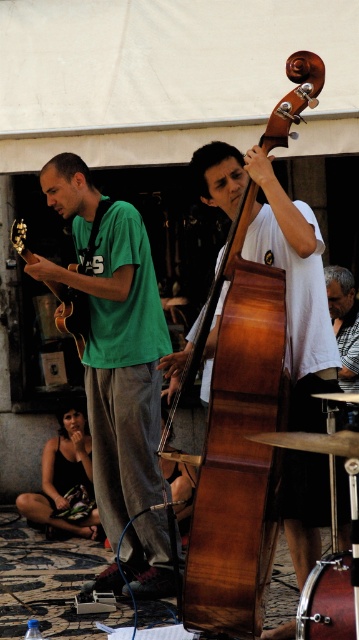
Question: Estimate the real-world distances between objects in this image. Which object is farther from the metallic silver drum at lower right?

Choices:
 (A) green matte shirt at left
 (B) wooden polished cello at center
 (C) black fabric dress at lower left

Answer: (C)

Question: Which point is farther to the camera?

Choices:
 (A) metallic silver drum at lower right
 (B) wooden polished cello at center

Answer: (B)

Question: Which object is positioned farthest from the wooden polished cello at center?

Choices:
 (A) black fabric dress at lower left
 (B) green matte shirt at left

Answer: (A)

Question: Considering the relative positions of black fabric dress at lower left and metallic silver drum at lower right in the image provided, where is black fabric dress at lower left located with respect to metallic silver drum at lower right?

Choices:
 (A) left
 (B) right

Answer: (A)

Question: Does green matte shirt at left lie in front of wooden polished cello at center?

Choices:
 (A) no
 (B) yes

Answer: (A)

Question: Is wooden polished cello at center further to camera compared to metallic silver drum at lower right?

Choices:
 (A) yes
 (B) no

Answer: (A)